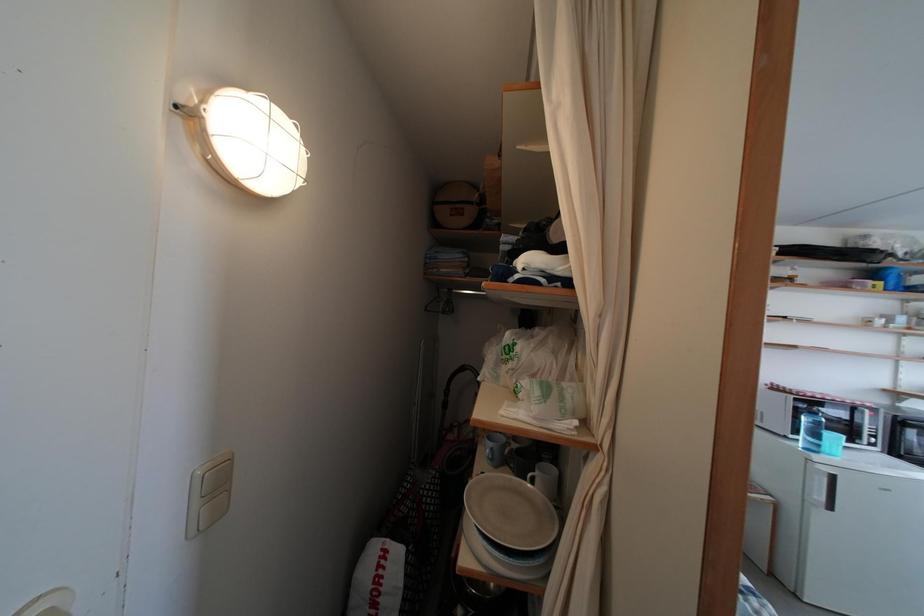
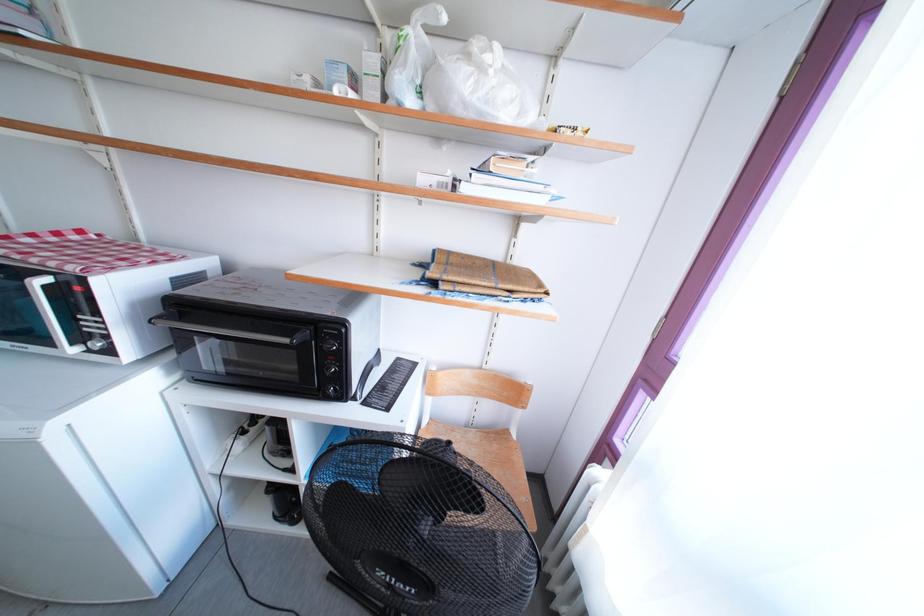
Question: What movement of the cameraman would produce the second image?

Choices:
 (A) Left
 (B) Right
 (C) Forward
 (D) Backward

Answer: (B)